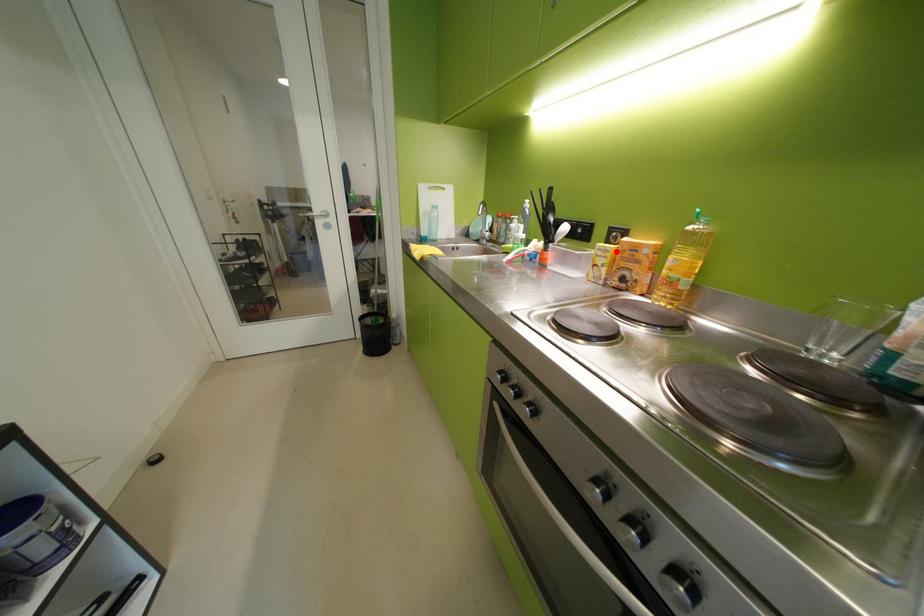
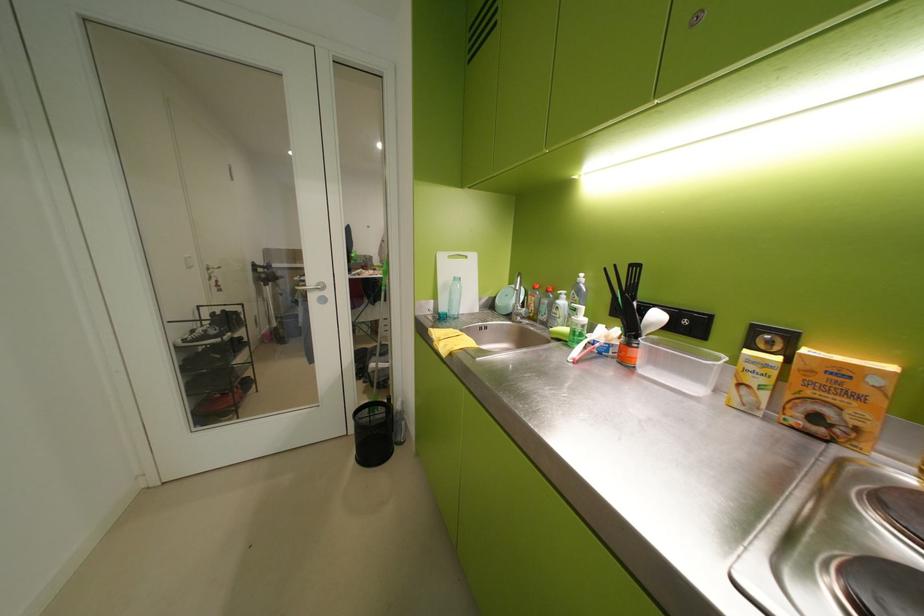
Locate, in the second image, the point that corresponds to the highlighted location in the first image.

(773, 365)